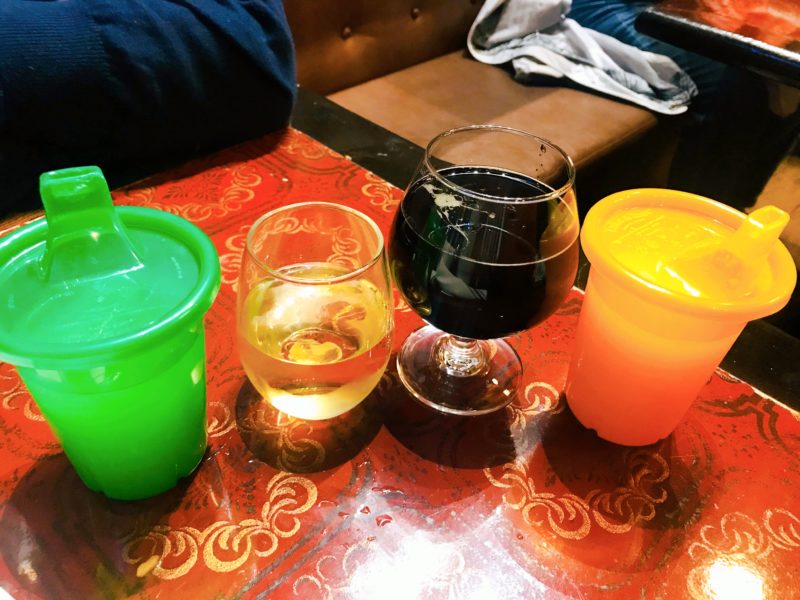
This screenshot has height=600, width=800. I want to click on sippie cup, so click(x=120, y=390).